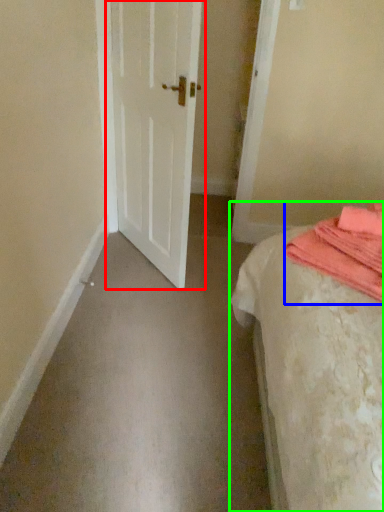
Question: Which object is positioned closest to door (highlighted by a red box)? Select from blanket (highlighted by a blue box) and bed (highlighted by a green box).

Choices:
 (A) blanket
 (B) bed

Answer: (B)